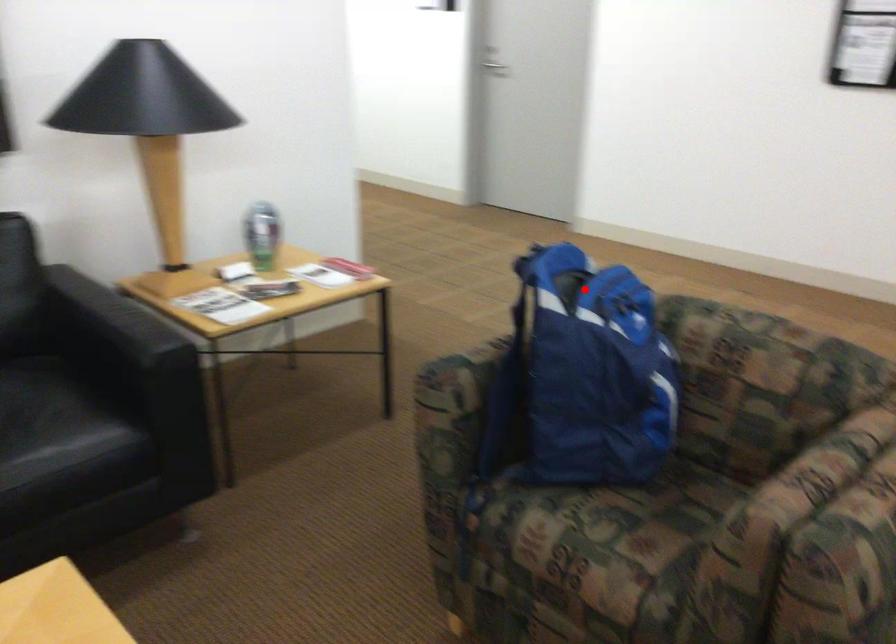
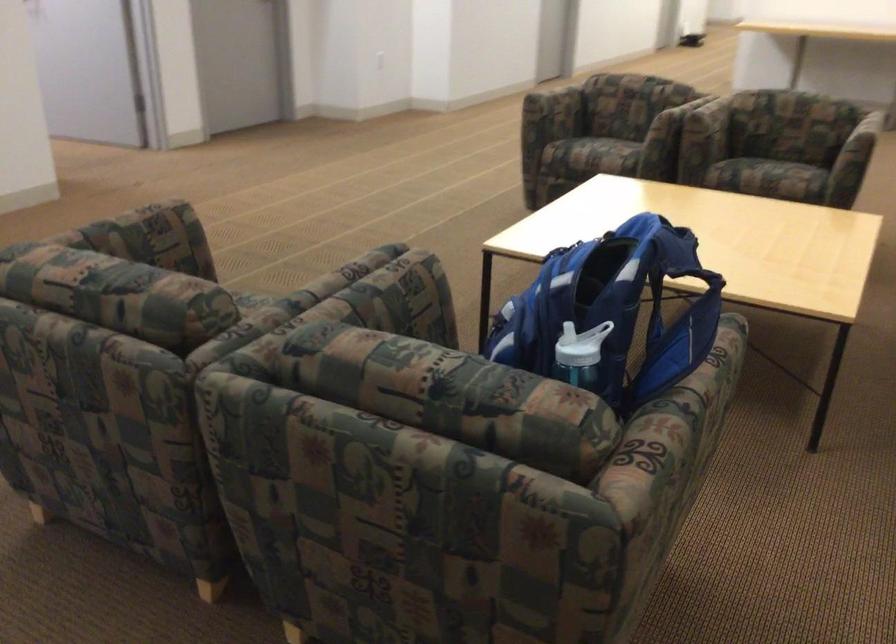
The point at the highlighted location is marked in the first image. Where is the corresponding point in the second image?

(613, 310)